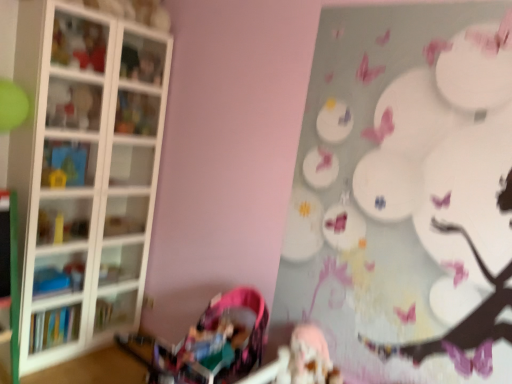
Question: Is matte plastic shelf at upper left, the fourth shelf when ordered from bottom to top, turned away from matte white cabinet at upper left?

Choices:
 (A) no
 (B) yes

Answer: (A)

Question: Can you confirm if matte plastic shelf at upper left, which is the second shelf from top to bottom, is positioned to the left of matte white cabinet at upper left?

Choices:
 (A) yes
 (B) no

Answer: (A)

Question: Would you say matte plastic shelf at upper left, the fourth shelf when ordered from bottom to top, contains matte white cabinet at upper left?

Choices:
 (A) yes
 (B) no

Answer: (B)

Question: From a real-world perspective, is matte plastic shelf at upper left, which is the second shelf from top to bottom, physically above matte white cabinet at upper left?

Choices:
 (A) yes
 (B) no

Answer: (B)

Question: Considering the relative sizes of matte plastic shelf at upper left, which is the second shelf from top to bottom, and matte white cabinet at upper left in the image provided, is matte plastic shelf at upper left, which is the second shelf from top to bottom, taller than matte white cabinet at upper left?

Choices:
 (A) no
 (B) yes

Answer: (B)

Question: In terms of height, does white glass shelves at left, acting as the second shelf starting from the bottom, look taller or shorter compared to translucent glass shelf at upper left, which appears as the 5th shelf when ordered from the bottom?

Choices:
 (A) short
 (B) tall

Answer: (B)

Question: From the image's perspective, is white glass shelves at left, arranged as the fourth shelf when viewed from the top, located above or below translucent glass shelf at upper left, which appears as the 5th shelf when ordered from the bottom?

Choices:
 (A) below
 (B) above

Answer: (A)

Question: Do you think white glass shelves at left, arranged as the fourth shelf when viewed from the top, is within translucent glass shelf at upper left, the 1th shelf when ordered from top to bottom, or outside of it?

Choices:
 (A) inside
 (B) outside

Answer: (B)

Question: From a real-world perspective, is white glass shelves at left, acting as the second shelf starting from the bottom, above or below translucent glass shelf at upper left, which appears as the 5th shelf when ordered from the bottom?

Choices:
 (A) above
 (B) below

Answer: (B)

Question: In terms of width, does matte plastic toy at upper left look wider or thinner when compared to white glass shelves at left, acting as the second shelf starting from the bottom?

Choices:
 (A) wide
 (B) thin

Answer: (B)

Question: In the image, is matte plastic toy at upper left on the left side or the right side of white glass shelves at left, arranged as the fourth shelf when viewed from the top?

Choices:
 (A) left
 (B) right

Answer: (B)

Question: From the image's perspective, is matte plastic toy at upper left above or below white glass shelves at left, acting as the second shelf starting from the bottom?

Choices:
 (A) below
 (B) above

Answer: (B)

Question: Is matte plastic toy at upper left bigger or smaller than white glass shelves at left, acting as the second shelf starting from the bottom?

Choices:
 (A) small
 (B) big

Answer: (A)

Question: Is blue plastic toy at left, the third shelf from the top, in front of or behind matte white cabinet at upper left in the image?

Choices:
 (A) front
 (B) behind

Answer: (A)

Question: Considering the positions of point (52, 168) and point (152, 44), is point (52, 168) closer or farther from the camera than point (152, 44)?

Choices:
 (A) farther
 (B) closer

Answer: (B)